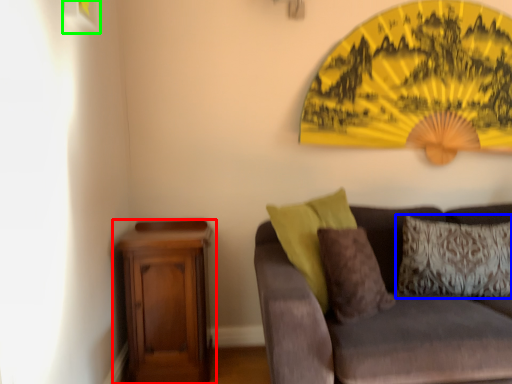
Question: Which object is positioned farthest from nightstand (highlighted by a red box)? Select from pillow (highlighted by a blue box) and picture frame (highlighted by a green box).

Choices:
 (A) pillow
 (B) picture frame

Answer: (B)